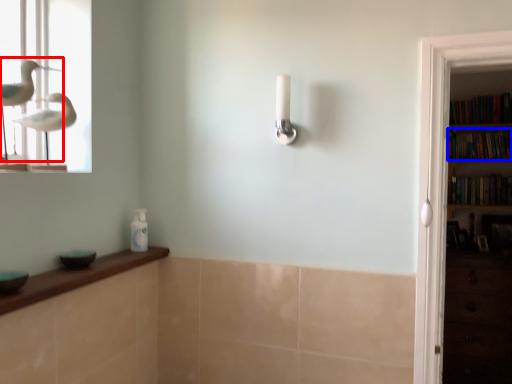
Question: Which of the following is the farthest to the observer, bird (highlighted by a red box) or book (highlighted by a blue box)?

Choices:
 (A) bird
 (B) book

Answer: (B)